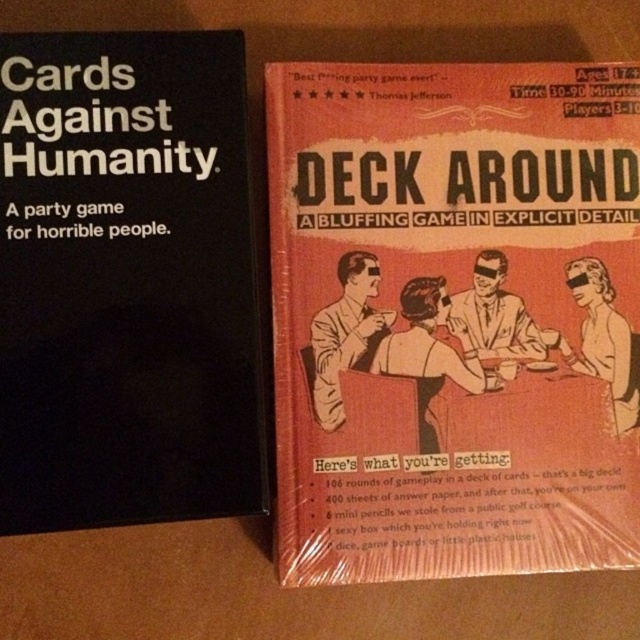
You need to place a 7.5 inch wide book on the wooden surface between the matte cardboard book at center and the black matte box at left. Is there enough space?

The distance between the matte cardboard book at center and the black matte box at left is 6.69 inches, which is less than the 7.5 inch width of the book. Therefore, there is not enough space to place the book between them.

Based on the photo, you are a game collector trying to organize your collection. You have two board game boxes on a wooden surface. One is black with white text labeled as Cards Against Humanity, and the other is red with a vintage illustration of four people around a table. You want to place a matte cardboard book exactly at the center between these two boxes. According to the coordinates provided, is the point at (x=454, y=317) the correct center point between the two board game boxes?

The point at (x=454, y=317) is indeed the correct center point between the two board game boxes, as the Objects Description specifies that this point indicates the matte cardboard book at center between them.

You are organizing a game night and want to place both the matte cardboard book at center and the black matte box at left on a shelf. The shelf has a height limit of 10 cm. Can both items fit vertically if placed side by side?

The matte cardboard book at center is larger in size compared to the black matte box at left. However, without specific height measurements for each item, it is impossible to determine if their combined height would exceed the 10 cm limit. More information is needed.